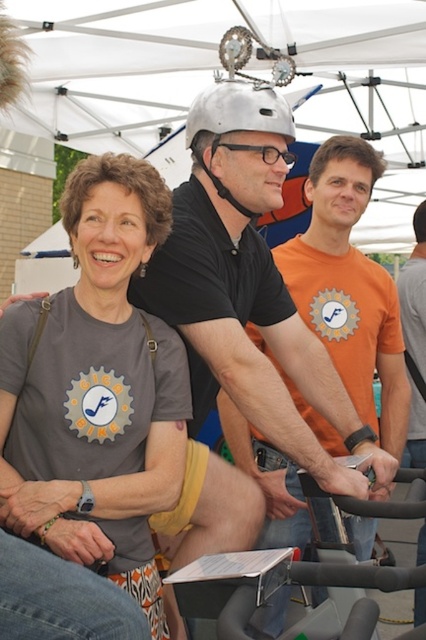
Can you confirm if white fabric canopy at upper center is wider than matte black helmet at center?

Indeed, white fabric canopy at upper center has a greater width compared to matte black helmet at center.

Who is higher up, white fabric canopy at upper center or matte black helmet at center?

Positioned higher is white fabric canopy at upper center.

Describe the element at coordinates (117, 68) in the screenshot. Image resolution: width=426 pixels, height=640 pixels. I see `white fabric canopy at upper center` at that location.

Find the location of a particular element. The image size is (426, 640). white fabric canopy at upper center is located at coordinates (117, 68).

Between gray matte shirt at center and silver metallic helmet at center, which one appears on the left side from the viewer's perspective?

From the viewer's perspective, gray matte shirt at center appears more on the left side.

Is point (155, 243) more distant than point (198, 104)?

No, (155, 243) is in front of (198, 104).

Is point (161, 243) closer to viewer compared to point (249, 211)?

Yes, point (161, 243) is in front of point (249, 211).

This screenshot has width=426, height=640. Find the location of `gray matte shirt at center`. gray matte shirt at center is located at coordinates (97, 376).

Does white fabric canopy at upper center have a smaller size compared to orange cotton shirt at center?

Yes.

Between white fabric canopy at upper center and orange cotton shirt at center, which one has less height?

Standing shorter between the two is white fabric canopy at upper center.

Does point (141, 35) lie in front of point (397, 280)?

No.

At what (x,y) coordinates should I click in order to perform the action: click on white fabric canopy at upper center. Please return your answer as a coordinate pair (x, y). This screenshot has width=426, height=640. Looking at the image, I should click on [x=117, y=68].